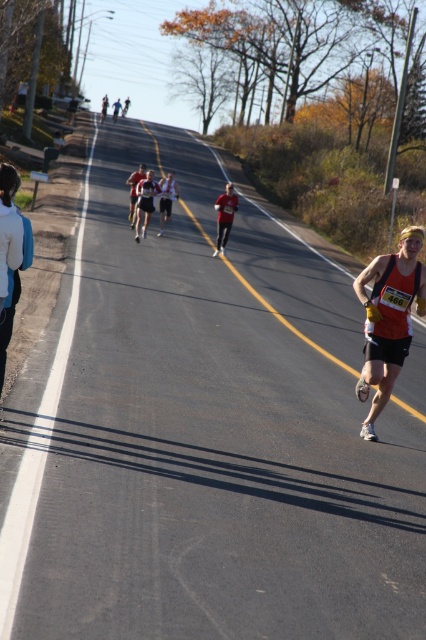
Does red fabric runner at center come behind matte red running suit at center?

Yes, it is.

Based on the photo, measure the distance between red fabric runner at center and camera.

red fabric runner at center is 85.75 feet away from camera.

Is point (163, 212) more distant than point (131, 205)?

No.

At what (x,y) coordinates should I click in order to perform the action: click on red fabric runner at center. Please return your answer as a coordinate pair (x, y). Looking at the image, I should click on (166, 198).

Is matte black running suit at center above red fabric runner at center?

No, matte black running suit at center is not above red fabric runner at center.

Is matte black running suit at center in front of red fabric runner at center?

Yes, matte black running suit at center is in front of red fabric runner at center.

Is point (146, 216) behind point (161, 188)?

That is False.

The width and height of the screenshot is (426, 640). I want to click on matte black running suit at center, so click(x=146, y=202).

Is red running outfit at center behind matte red shirt at center?

That is False.

Find the location of a particular element. The image size is (426, 640). red running outfit at center is located at coordinates (224, 216).

Between point (218, 250) and point (118, 109), which one is positioned behind?

Positioned behind is point (118, 109).

I want to click on red running outfit at center, so click(224, 216).